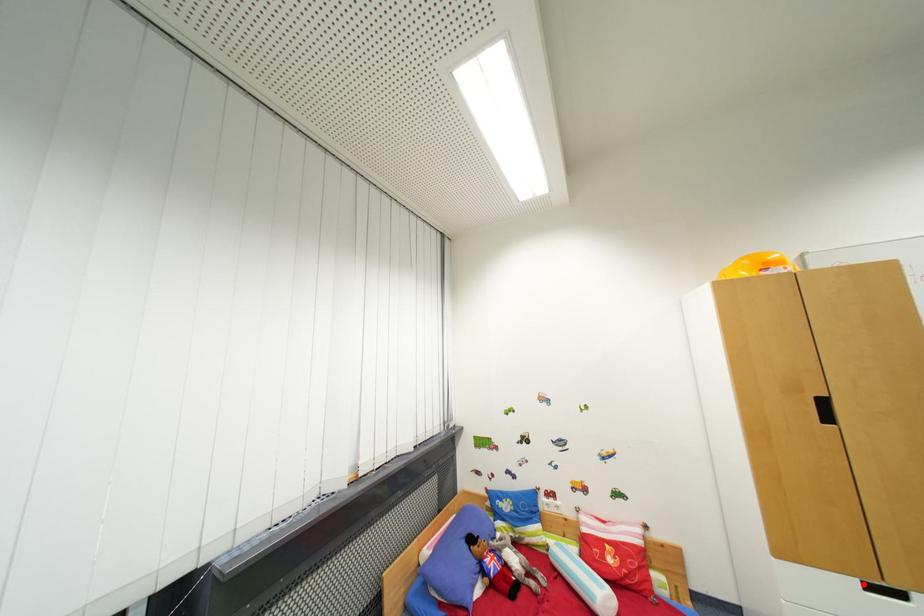
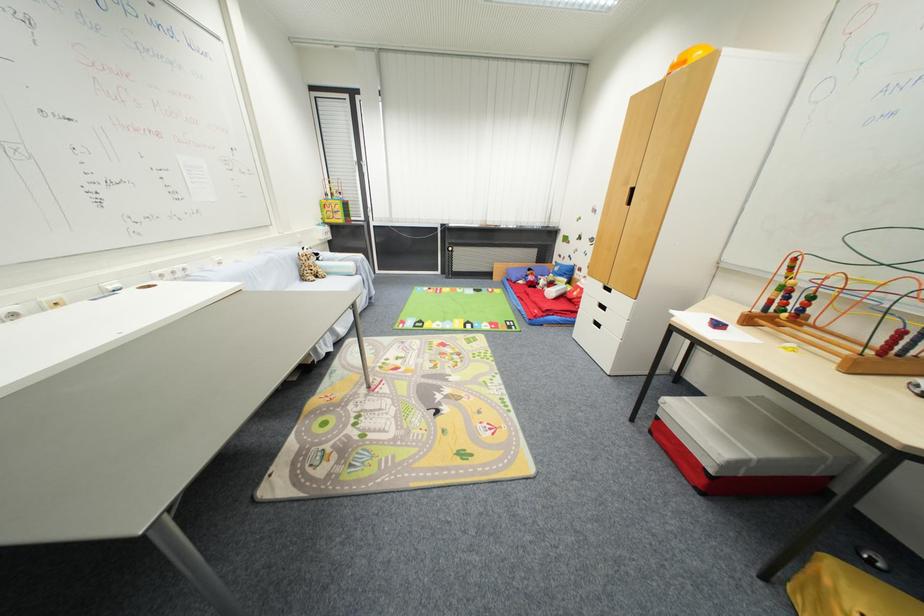
Where in the second image is the point corresponding to the highlighted location from the first image?

(606, 286)